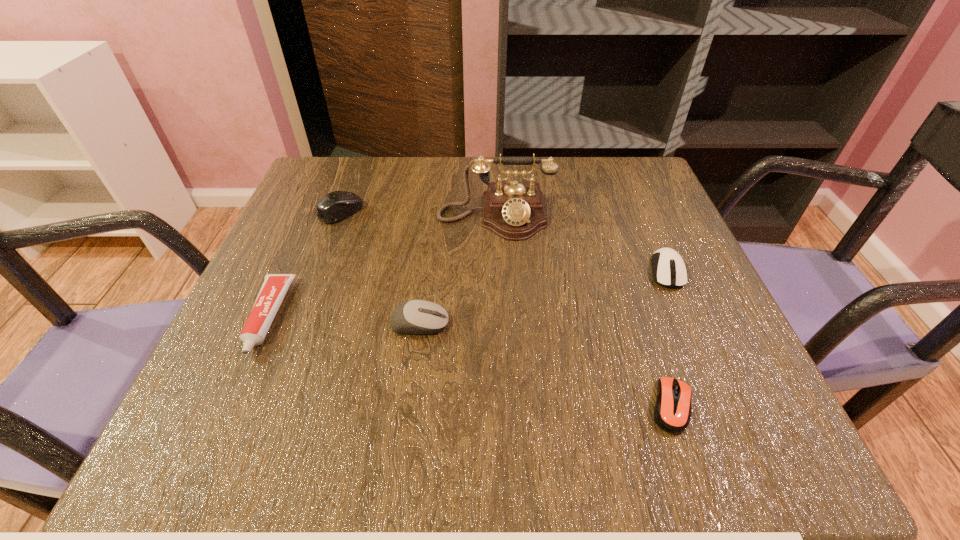
Find the location of a particular element. vacant space located on the wheel side of the third farthest computer mouse is located at coordinates (501, 324).

The image size is (960, 540). In order to click on vacant space positioned on the left of the rightmost object in this screenshot , I will do `click(511, 271)`.

The height and width of the screenshot is (540, 960). Find the location of `free location located at the nozzle of the toothpaste`. free location located at the nozzle of the toothpaste is located at coordinates (215, 437).

Identify the location of free point located on the left of the nearest computer mouse. point(454,406).

Locate an element on the screen. The image size is (960, 540). telephone that is positioned at the far edge is located at coordinates (514, 210).

Image resolution: width=960 pixels, height=540 pixels. I want to click on mouse positioned at the far edge, so pos(335,206).

Where is `object present at the near edge`? The image size is (960, 540). object present at the near edge is located at coordinates (672, 413).

Find the location of `mouse that is at the left edge`. mouse that is at the left edge is located at coordinates (335, 206).

Identify the location of toothpaste at the left edge. (274, 287).

At what (x,y) coordinates should I click in order to perform the action: click on object that is at the far left corner. Please return your answer as a coordinate pair (x, y). This screenshot has height=540, width=960. Looking at the image, I should click on (335, 206).